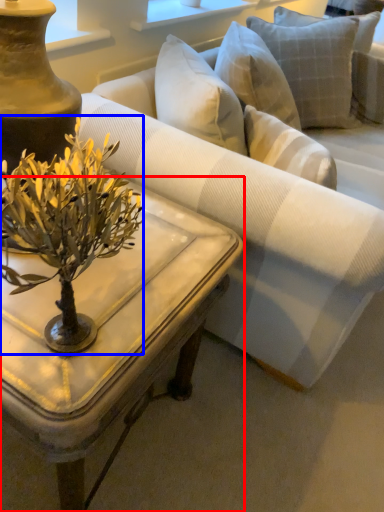
Question: Which object appears closest to the camera in this image, coffee table (highlighted by a red box) or flower (highlighted by a blue box)?

Choices:
 (A) coffee table
 (B) flower

Answer: (B)